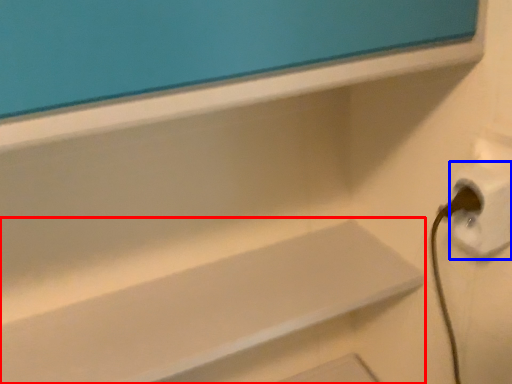
Question: Which object is closer to the camera taking this photo, shelf (highlighted by a red box) or electric outlet (highlighted by a blue box)?

Choices:
 (A) shelf
 (B) electric outlet

Answer: (B)